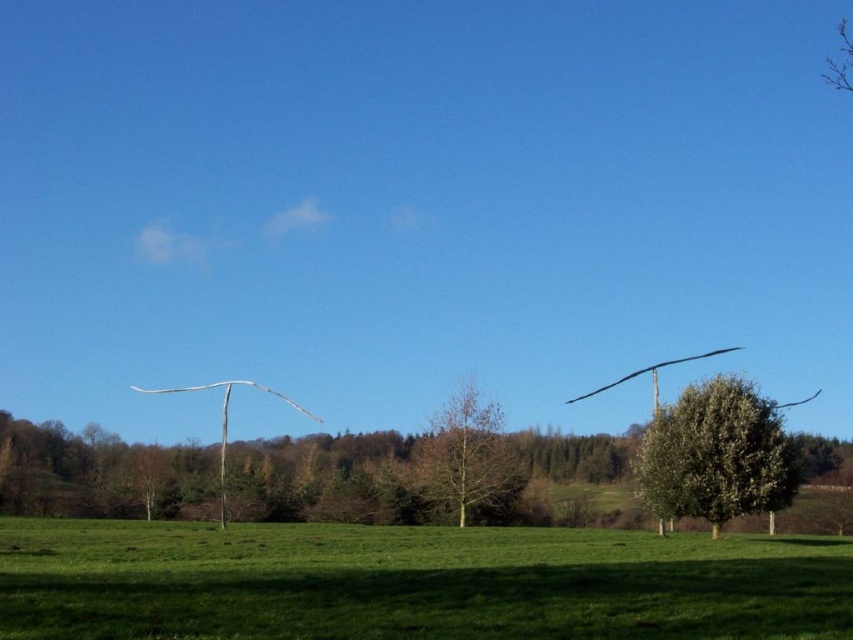
You are a farmer standing at the edge of the green grassy field at lower center. You want to plant a new tree that needs to grow taller than the green leafy tree at right. Based on the current height comparison, is this possible?

The green grassy field at lower center has a greater height compared to green leafy tree at right. Since the field is taller, planting a new tree there could potentially allow it to grow taller than the existing green leafy tree at right if given enough space and resources.